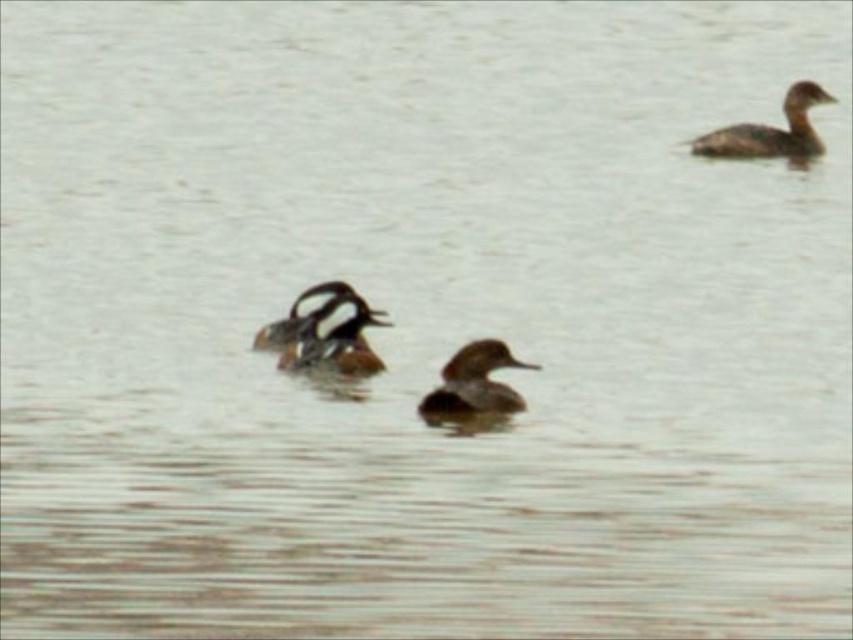
Consider the image. Is brown fuzzy duck at center in front of brown speckled duck at center?

Yes, it is in front of brown speckled duck at center.

Is brown fuzzy duck at center to the right of brown speckled duck at center from the viewer's perspective?

Yes, brown fuzzy duck at center is to the right of brown speckled duck at center.

Which is behind, point (373, 317) or point (317, 294)?

Positioned behind is point (373, 317).

At what (x,y) coordinates should I click in order to perform the action: click on brown fuzzy duck at center. Please return your answer as a coordinate pair (x, y). The image size is (853, 640). Looking at the image, I should click on (334, 337).

Can you confirm if brown matte duck at center is thinner than brown speckled duck at center?

In fact, brown matte duck at center might be wider than brown speckled duck at center.

Is point (537, 365) less distant than point (343, 285)?

No, (537, 365) is behind (343, 285).

Is point (456, 364) closer to viewer compared to point (306, 323)?

Yes, it is in front of point (306, 323).

What are the coordinates of `brown matte duck at center` in the screenshot? It's located at (474, 381).

Who is shorter, brown fuzzy duck at center or brown speckled duck at upper right?

brown fuzzy duck at center is shorter.

Who is positioned more to the right, brown fuzzy duck at center or brown speckled duck at upper right?

Positioned to the right is brown speckled duck at upper right.

Where is `brown fuzzy duck at center`? The width and height of the screenshot is (853, 640). brown fuzzy duck at center is located at coordinates 334,337.

You are a GUI agent. You are given a task and a screenshot of the screen. Output one action in this format:
    pyautogui.click(x=<x>, y=<y>)
    Task: Click on the brown fuzzy duck at center
    The image size is (853, 640).
    Given the screenshot: What is the action you would take?
    pyautogui.click(x=334, y=337)